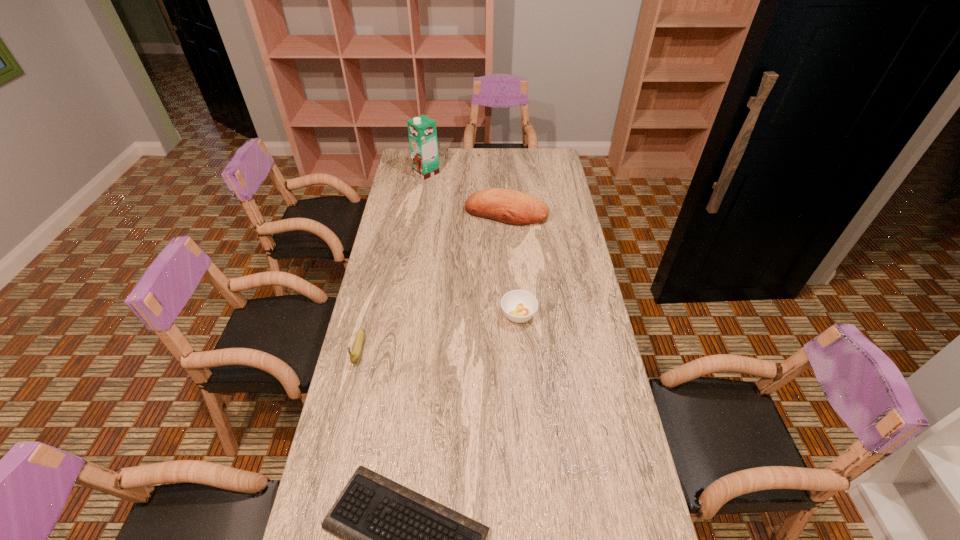
I want to click on free location at the left edge, so click(x=411, y=232).

At what (x,y) coordinates should I click in order to perform the action: click on vacant space at the right edge of the desktop. Please return your answer as a coordinate pair (x, y). The width and height of the screenshot is (960, 540). Looking at the image, I should click on (531, 174).

Identify the location of free spot at the far left corner of the desktop. (410, 158).

Find the location of a particular element. This screenshot has height=540, width=960. vacant area that lies between the farthest object and the second farthest object is located at coordinates (467, 193).

The height and width of the screenshot is (540, 960). What are the coordinates of `empty space that is in between the spectacles and the bread` in the screenshot? It's located at (544, 331).

Locate an element on the screen. blank region between the fourth farthest object and the carton is located at coordinates (393, 260).

Locate an element on the screen. Image resolution: width=960 pixels, height=540 pixels. free space between the third farthest object and the bread is located at coordinates (513, 264).

The image size is (960, 540). What are the coordinates of `vacant space in between the soup bowl and the tallest object` in the screenshot? It's located at (472, 244).

The width and height of the screenshot is (960, 540). Identify the location of blank region between the fourth tallest object and the leftmost object. (439, 332).

Find the location of a particular element. This screenshot has height=540, width=960. free spot between the farthest object and the fifth nearest object is located at coordinates (467, 193).